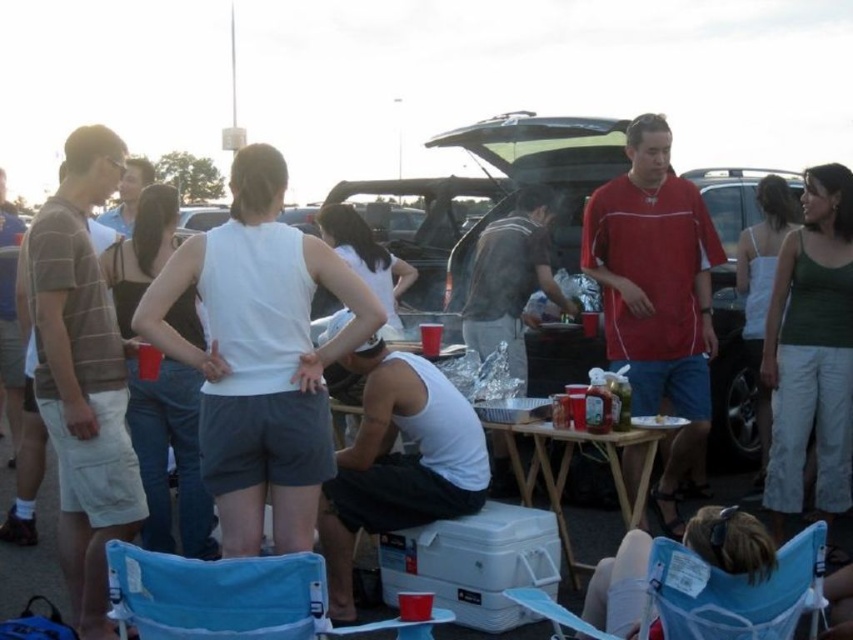
Consider the image. Can you confirm if red jersey at center is positioned to the left of blue fabric chair at lower left?

In fact, red jersey at center is to the right of blue fabric chair at lower left.

Does red jersey at center appear under blue fabric chair at lower left?

No.

Which is in front, point (657, 227) or point (143, 602)?

Point (143, 602)

You are a GUI agent. You are given a task and a screenshot of the screen. Output one action in this format:
    pyautogui.click(x=<x>, y=<y>)
    Task: Click on the red jersey at center
    
    Given the screenshot: What is the action you would take?
    pyautogui.click(x=656, y=292)

Can you confirm if brown striped shirt at left is positioned above white matte tank top at center?

Yes, brown striped shirt at left is above white matte tank top at center.

Image resolution: width=853 pixels, height=640 pixels. I want to click on brown striped shirt at left, so click(x=83, y=376).

Is point (80, 198) in front of point (482, 461)?

Yes.

At what (x,y) coordinates should I click in order to perform the action: click on brown striped shirt at left. Please return your answer as a coordinate pair (x, y). The height and width of the screenshot is (640, 853). Looking at the image, I should click on (83, 376).

Is blue fabric chair at lower right taller than dark gray fabric shirt at center?

No.

Who is more forward, (717, 624) or (560, 305)?

Point (717, 624) is more forward.

The image size is (853, 640). Describe the element at coordinates (734, 593) in the screenshot. I see `blue fabric chair at lower right` at that location.

Image resolution: width=853 pixels, height=640 pixels. I want to click on blue fabric chair at lower right, so 734,593.